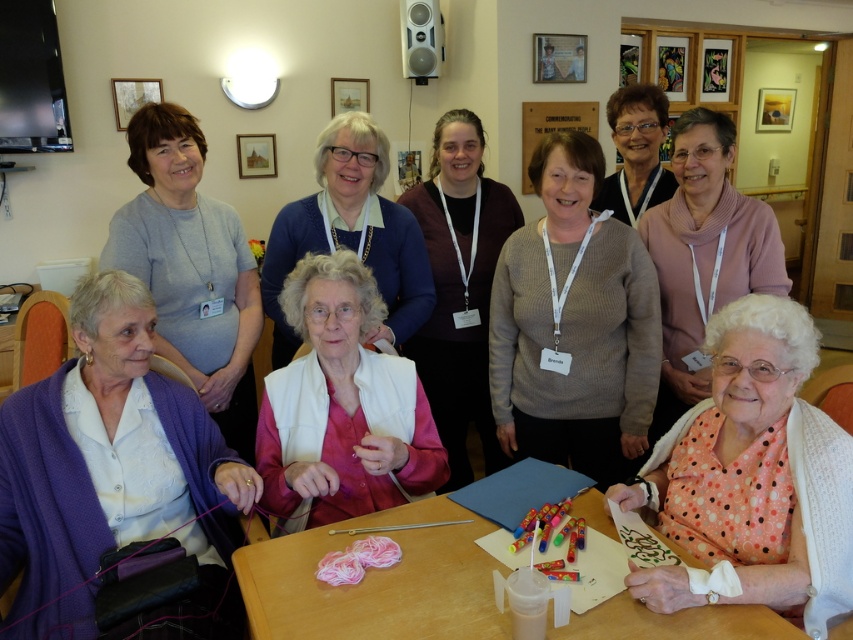
Between gray matte sweater at left and pink woolen sweater at center, which one is positioned lower?

gray matte sweater at left is lower down.

What do you see at coordinates (190, 268) in the screenshot? The width and height of the screenshot is (853, 640). I see `gray matte sweater at left` at bounding box center [190, 268].

Between point (148, 262) and point (276, 252), which one is positioned behind?

Point (276, 252)

Where is `gray matte sweater at left`? This screenshot has width=853, height=640. gray matte sweater at left is located at coordinates (190, 268).

Consider the image. Between purple knitwear at center and pink woolen sweater at center, which one appears on the left side from the viewer's perspective?

Positioned to the left is pink woolen sweater at center.

Can you confirm if purple knitwear at center is positioned to the right of pink woolen sweater at center?

Correct, you'll find purple knitwear at center to the right of pink woolen sweater at center.

You are a GUI agent. You are given a task and a screenshot of the screen. Output one action in this format:
    pyautogui.click(x=<x>, y=<y>)
    Task: Click on the purple knitwear at center
    
    Given the screenshot: What is the action you would take?
    pyautogui.click(x=459, y=288)

Consider the image. Is knitted beige sweater at center below wooden table at lower center?

No, knitted beige sweater at center is not below wooden table at lower center.

Between point (508, 344) and point (486, 580), which one is positioned behind?

The point (508, 344) is behind.

You are a GUI agent. You are given a task and a screenshot of the screen. Output one action in this format:
    pyautogui.click(x=<x>, y=<y>)
    Task: Click on the knitted beige sweater at center
    The image size is (853, 640).
    Given the screenshot: What is the action you would take?
    pyautogui.click(x=573, y=324)